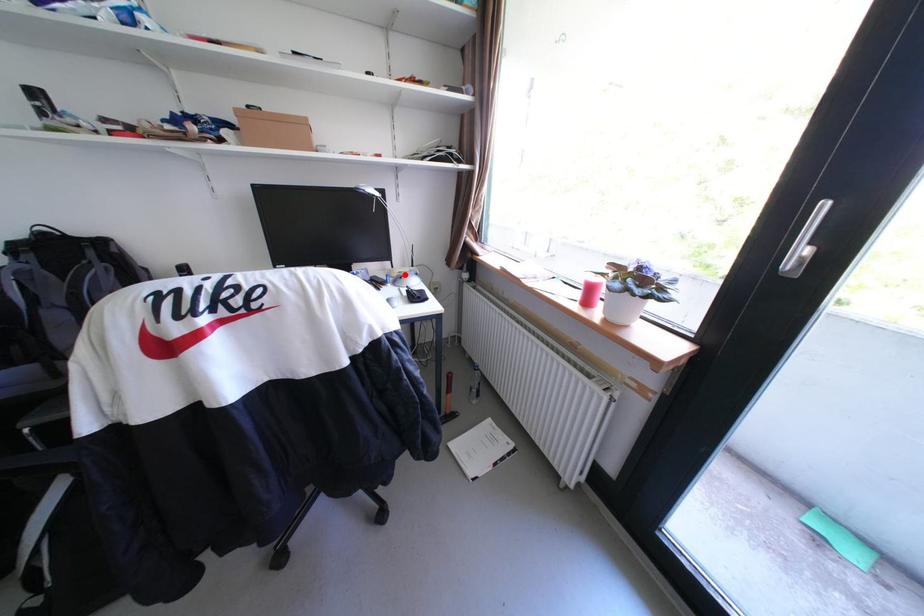
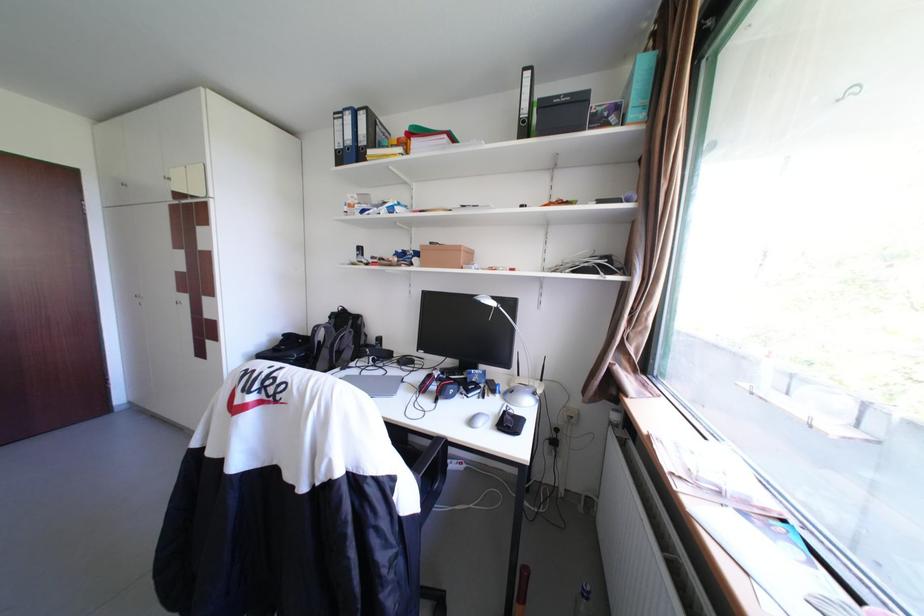
In the second image, find the point that corresponds to the highlighted location in the first image.

(523, 386)